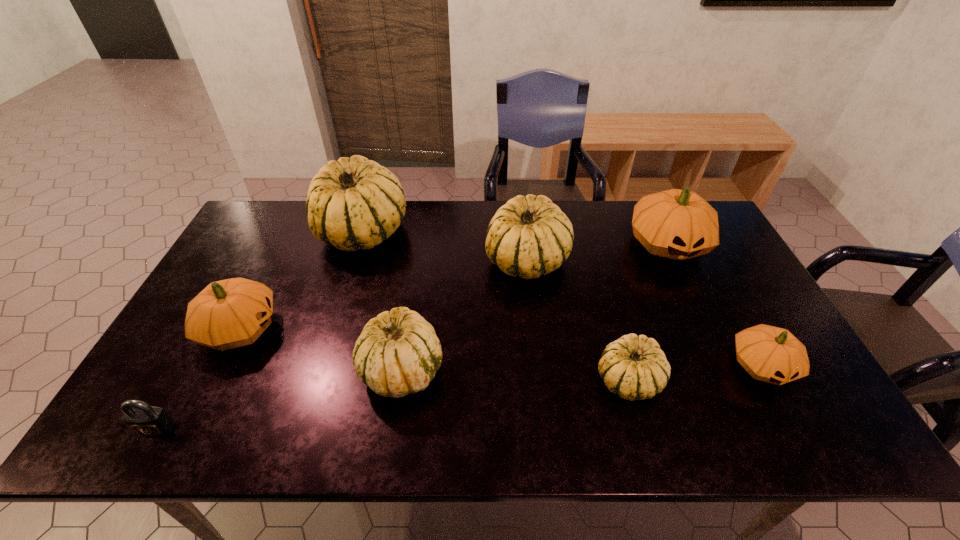
In order to click on the nearest object in this screenshot , I will do `click(140, 417)`.

At what (x,y) coordinates should I click in order to perform the action: click on vacant space situated 0.280m on the right of the biggest white gourd. Please return your answer as a coordinate pair (x, y). This screenshot has height=540, width=960. Looking at the image, I should click on (492, 231).

Image resolution: width=960 pixels, height=540 pixels. In order to click on free space located 0.400m on the side of the biggest orange gourd with the carved face in this screenshot , I will do `click(734, 386)`.

Identify the location of vacant space located on the right of the fourth gourd from left to right. The image size is (960, 540). (623, 260).

This screenshot has width=960, height=540. In order to click on free space located on the side of the leftmost orange gourd with the carved face in this screenshot , I will do `click(314, 329)`.

At what (x,y) coordinates should I click in order to perform the action: click on blank space located 0.340m on the right of the third biggest white gourd. Please return your answer as a coordinate pair (x, y). Image resolution: width=960 pixels, height=540 pixels. Looking at the image, I should click on (581, 369).

Find the location of a particular element. The width and height of the screenshot is (960, 540). vacant space located 0.050m on the side of the smallest orange gourd with the carved face is located at coordinates (788, 414).

Find the location of a particular element. The height and width of the screenshot is (540, 960). vacant point located 0.210m on the back of the rightmost white gourd is located at coordinates (605, 294).

Find the location of a particular element. This screenshot has height=540, width=960. object at the near edge is located at coordinates (140, 417).

Find the location of `gourd at the left edge`. gourd at the left edge is located at coordinates (230, 313).